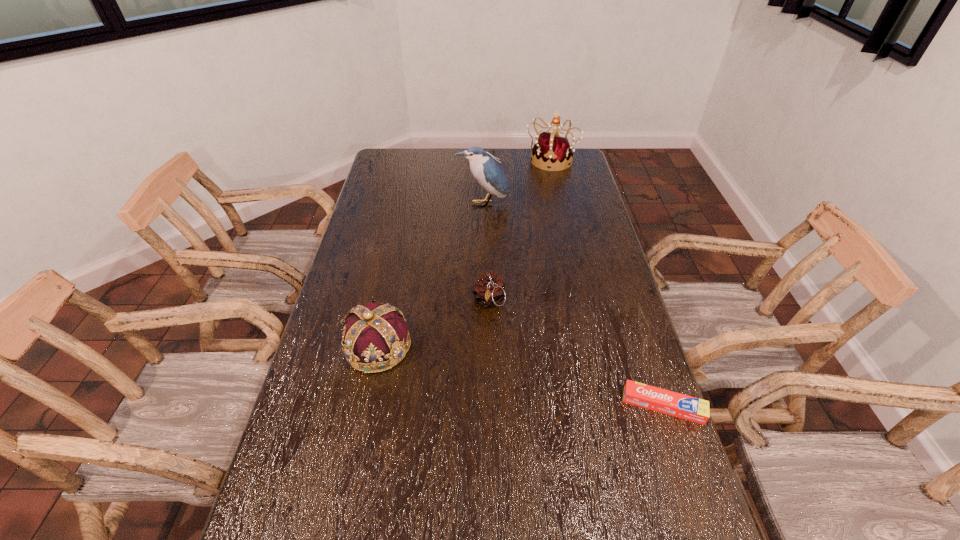
The width and height of the screenshot is (960, 540). Identify the location of free spot between the shortest object and the third nearest object. (576, 354).

Locate an element on the screen. free area in between the pinecone and the nearest object is located at coordinates (576, 354).

Locate an element on the screen. The height and width of the screenshot is (540, 960). vacant point located between the second farthest object and the toothpaste is located at coordinates (573, 305).

At what (x,y) coordinates should I click in order to perform the action: click on free space between the crown and the tiara. Please return your answer as a coordinate pair (x, y). The width and height of the screenshot is (960, 540). Looking at the image, I should click on (464, 253).

At what (x,y) coordinates should I click in order to perform the action: click on vacant point located between the farthest object and the leftmost object. Please return your answer as a coordinate pair (x, y). Looking at the image, I should click on (464, 253).

The height and width of the screenshot is (540, 960). In order to click on free point between the nearest object and the crown in this screenshot , I will do `click(520, 376)`.

Where is `free space between the second nearest object and the nearest object`? The width and height of the screenshot is (960, 540). free space between the second nearest object and the nearest object is located at coordinates (520, 376).

Select which object appears as the fourth closest to the nearest object. Please provide its 2D coordinates. Your answer should be formatted as a tuple, i.e. [(x, y)], where the tuple contains the x and y coordinates of a point satisfying the conditions above.

[(552, 150)]

Identify which object is the fourth nearest to the shortest object. Please provide its 2D coordinates. Your answer should be formatted as a tuple, i.e. [(x, y)], where the tuple contains the x and y coordinates of a point satisfying the conditions above.

[(552, 150)]

At what (x,y) coordinates should I click in order to perform the action: click on vacant region that satisfies the following two spatial constraints: 1. on the back side of the tiara; 2. on the left side of the pinecone. Please return your answer as a coordinate pair (x, y). The width and height of the screenshot is (960, 540). Looking at the image, I should click on pyautogui.click(x=487, y=159).